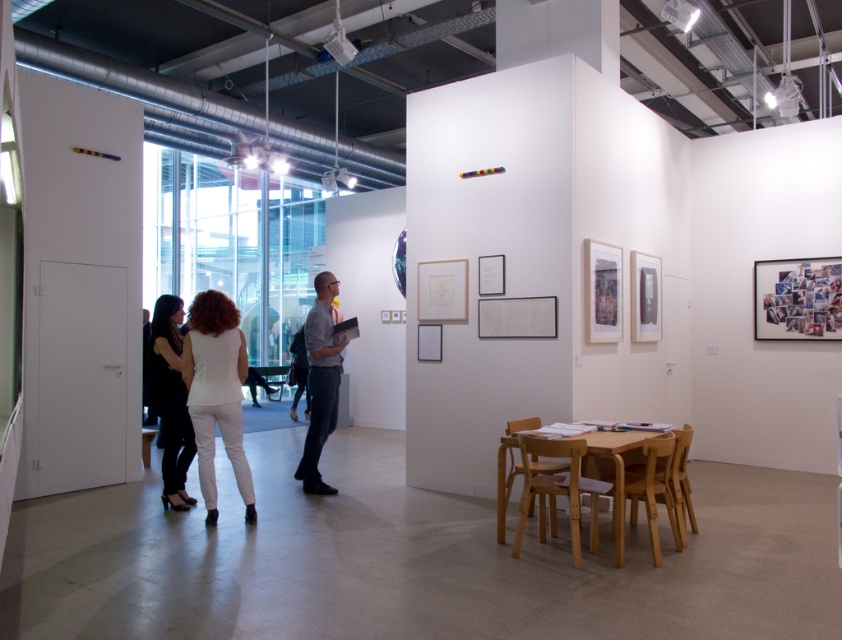
Is black fabric dress at left to the right of gray cotton shirt at center from the viewer's perspective?

In fact, black fabric dress at left is to the left of gray cotton shirt at center.

Can you confirm if black fabric dress at left is shorter than gray cotton shirt at center?

Indeed, black fabric dress at left has a lesser height compared to gray cotton shirt at center.

Find the location of a particular element. black fabric dress at left is located at coordinates (171, 400).

Locate an element on the screen. black fabric dress at left is located at coordinates (171, 400).

What do you see at coordinates (216, 392) in the screenshot?
I see `white matte pants at lower center` at bounding box center [216, 392].

Between point (201, 468) and point (174, 339), which one is positioned in front?

Positioned in front is point (201, 468).

Is point (201, 304) farther from viewer compared to point (164, 394)?

That is False.

At what (x,y) coordinates should I click in order to perform the action: click on white matte pants at lower center. Please return your answer as a coordinate pair (x, y). The width and height of the screenshot is (842, 640). Looking at the image, I should click on (216, 392).

How distant is white matte pants at lower center from gray cotton shirt at center?

white matte pants at lower center is 37.74 inches from gray cotton shirt at center.

What are the coordinates of `white matte pants at lower center` in the screenshot? It's located at (216, 392).

This screenshot has height=640, width=842. Identify the location of white matte pants at lower center. (216, 392).